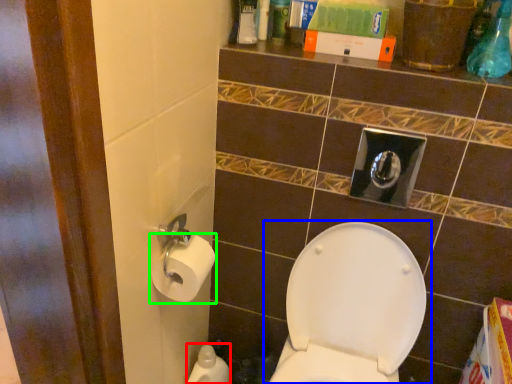
Question: Estimate the real-world distances between objects in this image. Which object is farther from cleaning product (highlighted by a red box), toilet (highlighted by a blue box) or toiletry (highlighted by a green box)?

Choices:
 (A) toilet
 (B) toiletry

Answer: (B)